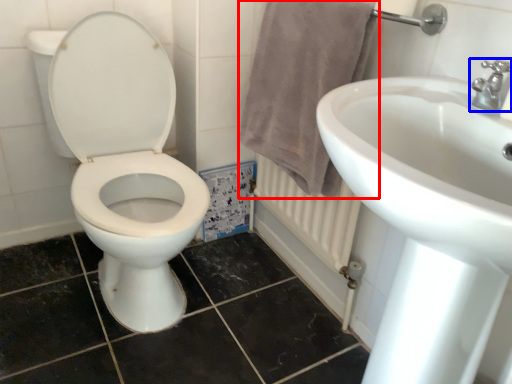
Question: Which of the following is the farthest to the observer, bath towel (highlighted by a red box) or tap (highlighted by a blue box)?

Choices:
 (A) bath towel
 (B) tap

Answer: (A)